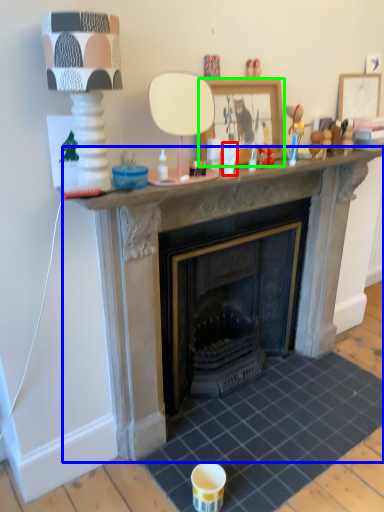
Question: Considering the real-world distances, which object is closest to coffee cup (highlighted by a red box)? fireplace (highlighted by a blue box) or picture frame (highlighted by a green box).

Choices:
 (A) fireplace
 (B) picture frame

Answer: (B)